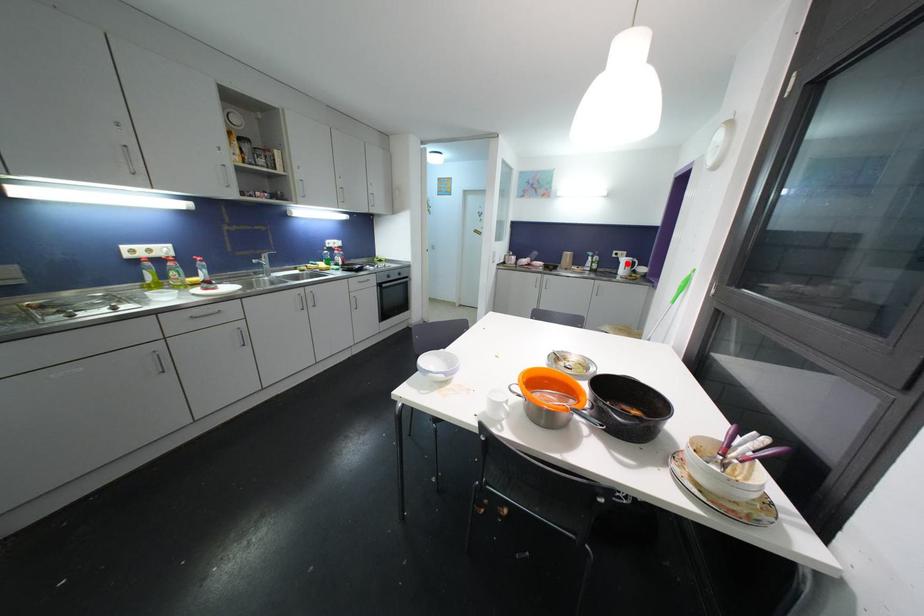
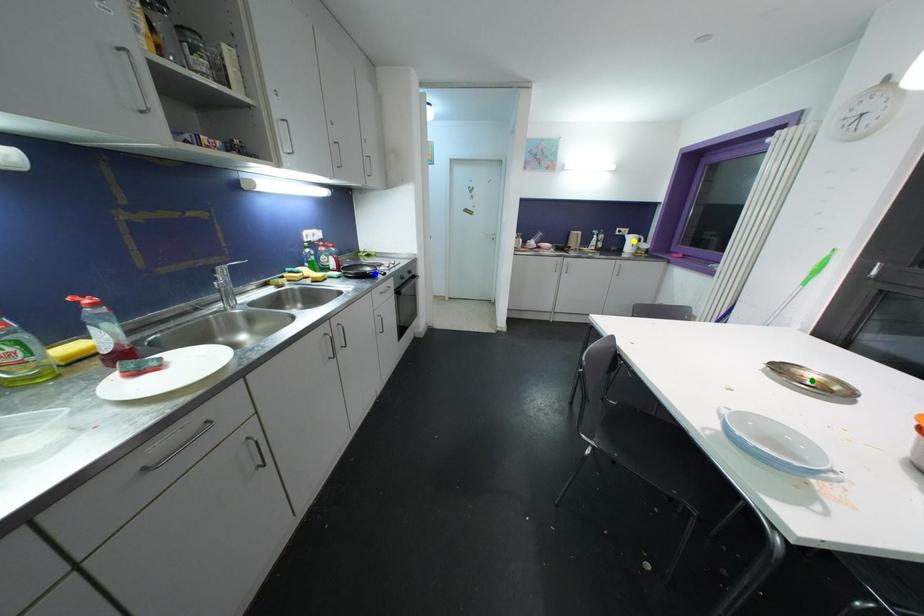
Question: I am providing you with two images of the same scene from different viewpoints. A red point is marked on the first image. You are given multiple points on the second image. In image 2, which mark is for the same physical point as the one in image 1?

Choices:
 (A) blue point
 (B) green point
 (C) yellow point

Answer: (C)